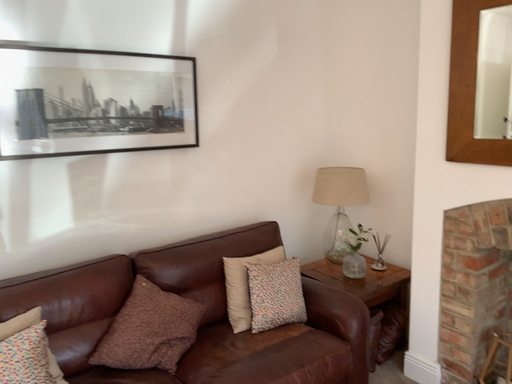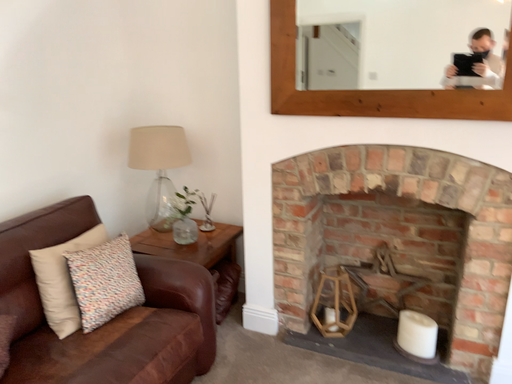
Question: Which way did the camera rotate in the video?

Choices:
 (A) rotated left
 (B) rotated right

Answer: (B)